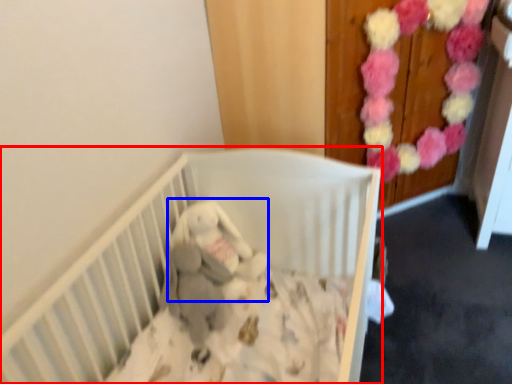
Question: Which point is closer to the camera, infant bed (highlighted by a red box) or baby elephant (highlighted by a blue box)?

Choices:
 (A) infant bed
 (B) baby elephant

Answer: (A)